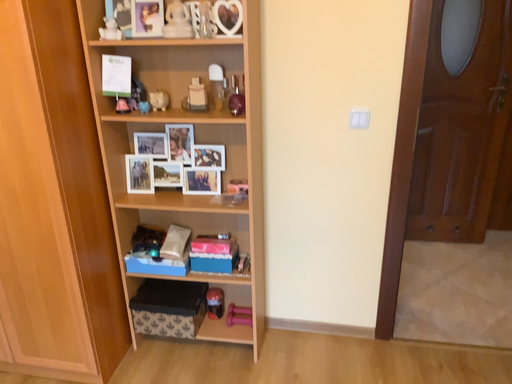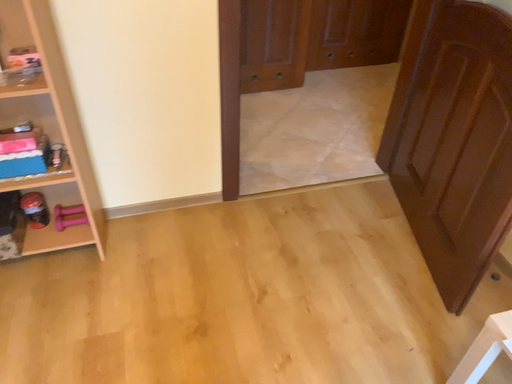
Question: How did the camera likely rotate when shooting the video?

Choices:
 (A) rotated upward
 (B) rotated downward

Answer: (B)